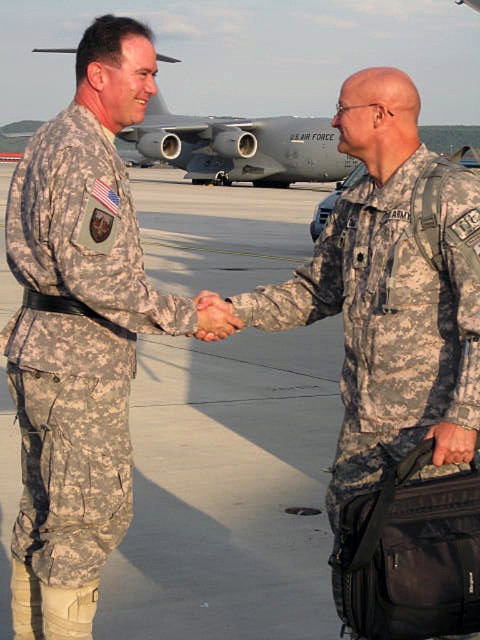
The image size is (480, 640). Describe the element at coordinates (75, 342) in the screenshot. I see `camouflage fabric pants at left` at that location.

Can you confirm if camouflage fabric pants at left is wider than camouflage fabric handshake at center?

Yes, camouflage fabric pants at left is wider than camouflage fabric handshake at center.

Find the location of `camouflage fabric pants at left`. camouflage fabric pants at left is located at coordinates (75, 342).